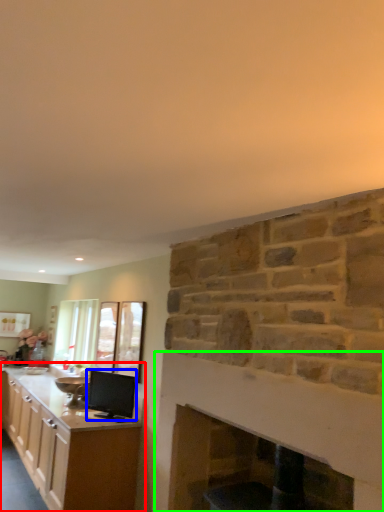
Question: Estimate the real-world distances between objects in this image. Which object is farther from cabinetry (highlighted by a red box), appliance (highlighted by a blue box) or fireplace (highlighted by a green box)?

Choices:
 (A) appliance
 (B) fireplace

Answer: (B)